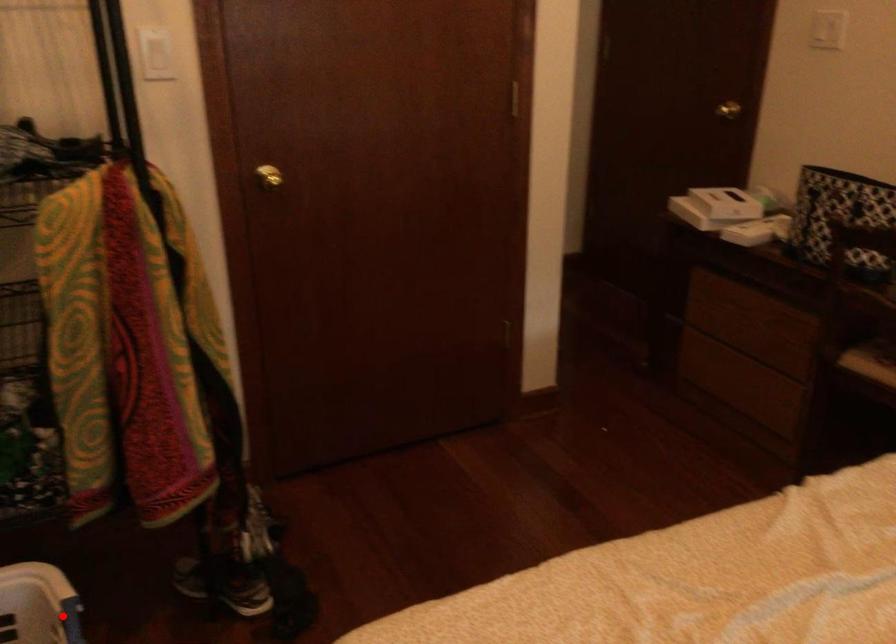
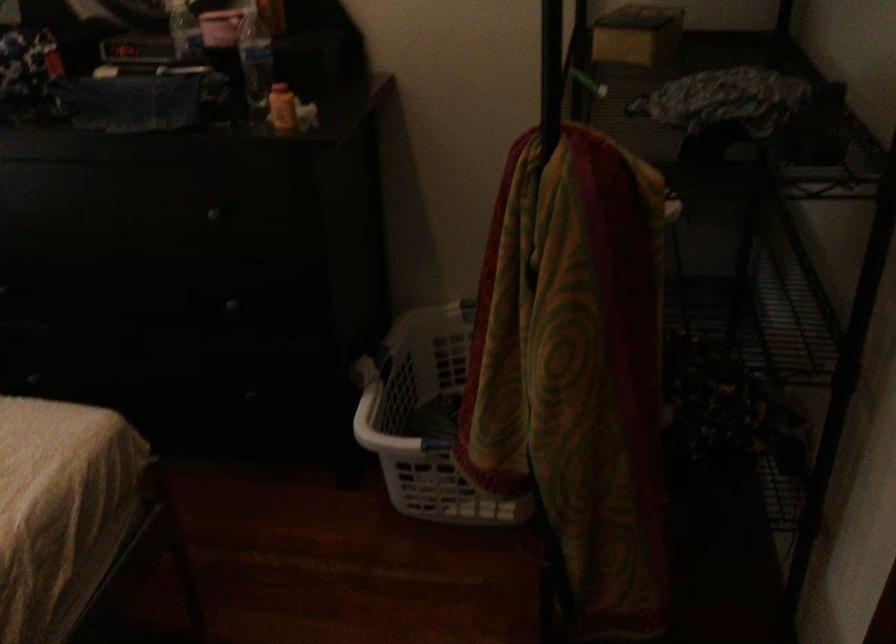
Question: I am providing you with two images of the same scene from different viewpoints. A red point is marked on the first image. Can you still see the location of the red point in image 2?

Choices:
 (A) Yes
 (B) No

Answer: (B)